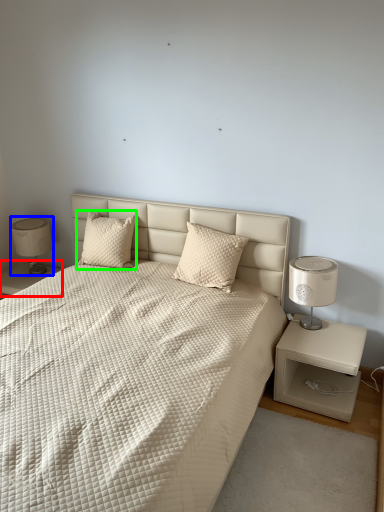
Question: Based on their relative distances, which object is nearer to nightstand (highlighted by a red box)? Choose from table lamp (highlighted by a blue box) and pillow (highlighted by a green box).

Choices:
 (A) table lamp
 (B) pillow

Answer: (A)